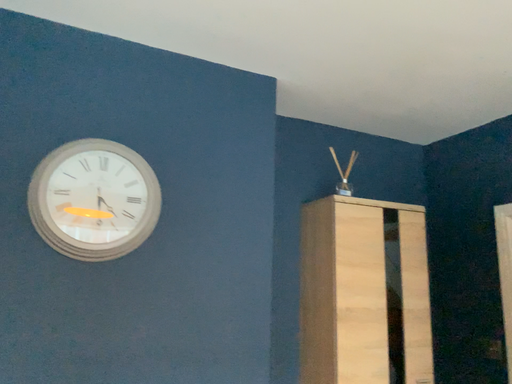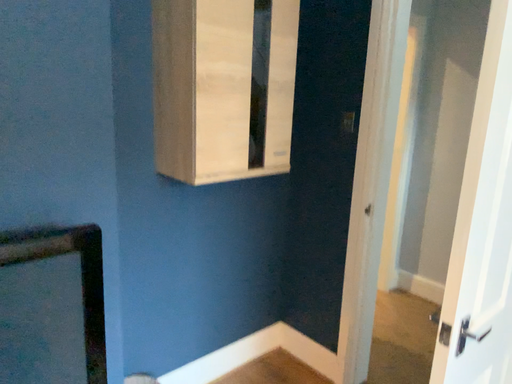
Question: How did the camera likely rotate when shooting the video?

Choices:
 (A) rotated right
 (B) rotated left

Answer: (A)